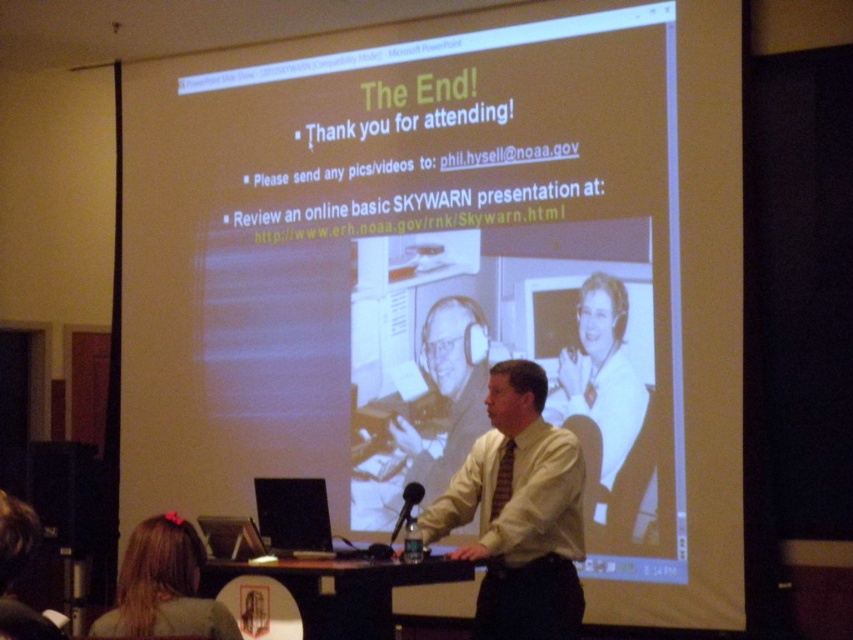
Question: Is brown hair at lower left to the left of white matte headphones at center from the viewer's perspective?

Choices:
 (A) no
 (B) yes

Answer: (B)

Question: Which point is closer to the camera?

Choices:
 (A) (585, 397)
 (B) (503, 500)
 (C) (131, 618)

Answer: (C)

Question: Can you confirm if brown hair at lower left is smaller than white matte headphones at center?

Choices:
 (A) no
 (B) yes

Answer: (B)

Question: Is white matte projection screen at center bigger than yellow shirt at center?

Choices:
 (A) no
 (B) yes

Answer: (B)

Question: Which of the following is the closest to the observer?

Choices:
 (A) (543, 522)
 (B) (494, 486)
 (C) (125, 602)

Answer: (C)

Question: Which of the following is the closest to the observer?

Choices:
 (A) striped fabric tie at center
 (B) white matte headphones at center
 (C) brown hair at lower left
 (D) black plastic microphone at center

Answer: (C)